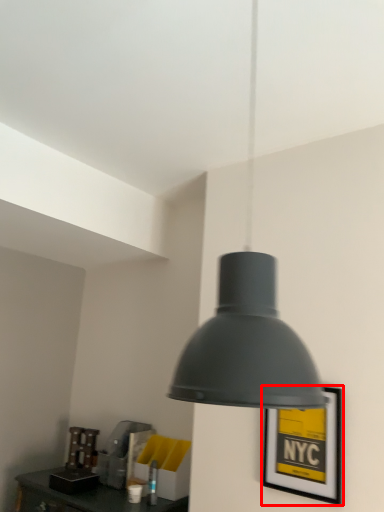
Question: From the image's perspective, where is picture frame (annotated by the red box) located relative to lamp?

Choices:
 (A) below
 (B) above

Answer: (A)